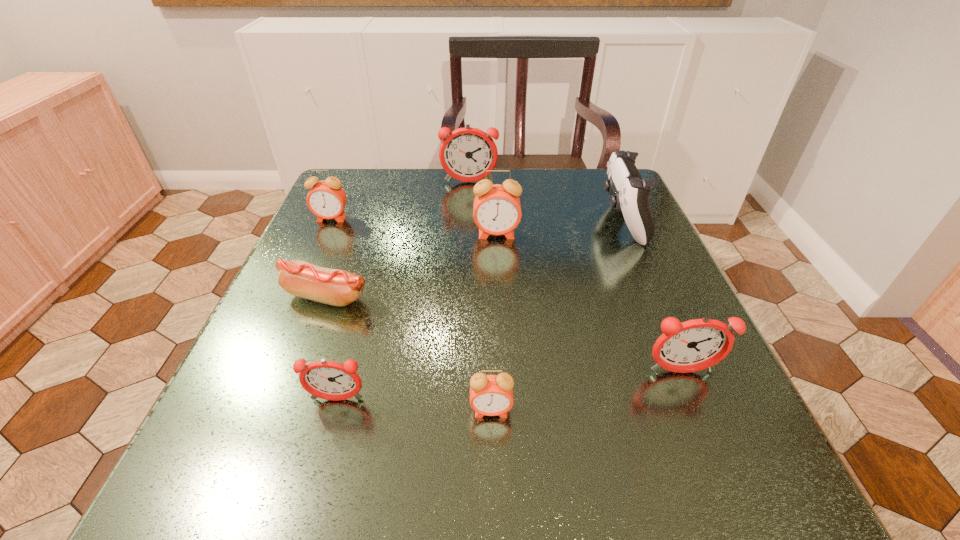
Locate an element on the screen. This screenshot has height=540, width=960. reddish-pink alarm clock that stands as the closest to the brown sausage is located at coordinates (329, 380).

Locate an element on the screen. reddish-pink alarm clock that is the third closest one to the farthest pink alarm clock is located at coordinates (694, 345).

Find the location of a particular element. This screenshot has height=540, width=960. pink alarm clock that is the closest to the third nearest object is located at coordinates (491, 395).

This screenshot has height=540, width=960. I want to click on pink alarm clock that stands as the closest to the fourth nearest alarm clock, so click(326, 199).

At what (x,y) coordinates should I click in order to perform the action: click on vacant space that satisfies the following two spatial constraints: 1. on the front-facing side of the control; 2. on the front-facing side of the leftmost reddish-pink alarm clock. Please return your answer as a coordinate pair (x, y). Looking at the image, I should click on (699, 400).

Locate an element on the screen. vacant space that satisfies the following two spatial constraints: 1. on the front-facing side of the control; 2. on the front-facing side of the second farthest reddish-pink alarm clock is located at coordinates (687, 372).

Locate an element on the screen. The height and width of the screenshot is (540, 960). vacant space that satisfies the following two spatial constraints: 1. on the face of the sausage; 2. on the right side of the leftmost alarm clock is located at coordinates (296, 296).